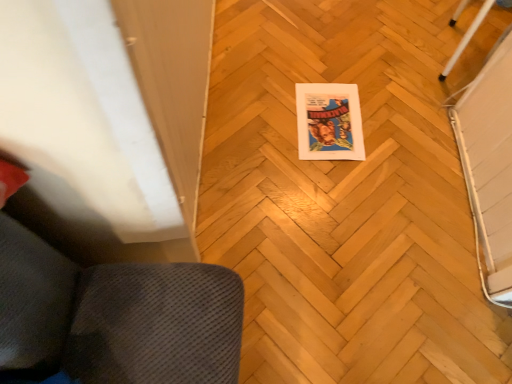
Question: From a real-world perspective, relative to white glossy pole at upper right, is wooden parquet floor at center vertically above or below?

Choices:
 (A) above
 (B) below

Answer: (B)

Question: Considering the positions of wooden parquet floor at center and white glossy pole at upper right in the image, is wooden parquet floor at center wider or thinner than white glossy pole at upper right?

Choices:
 (A) wide
 (B) thin

Answer: (A)

Question: Which object is the closest to the white glossy pole at upper right?

Choices:
 (A) wooden parquet floor at center
 (B) matte paper comic book at center

Answer: (B)

Question: Which object is the farthest from the wooden parquet floor at center?

Choices:
 (A) white glossy pole at upper right
 (B) matte paper comic book at center

Answer: (A)